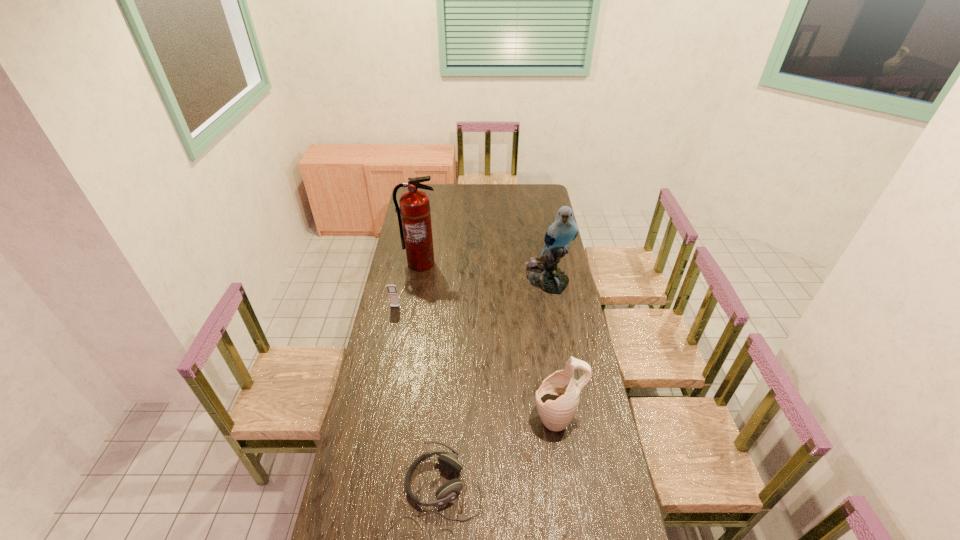
Find the location of a particular element. The width and height of the screenshot is (960, 540). fire extinguisher is located at coordinates (414, 209).

Where is `parakeet`? The image size is (960, 540). parakeet is located at coordinates (542, 272).

Where is `pitcher`? The height and width of the screenshot is (540, 960). pitcher is located at coordinates (557, 399).

Where is `the fourth farthest object`? the fourth farthest object is located at coordinates (557, 399).

I want to click on the second shortest object, so click(x=392, y=290).

At what (x,y) coordinates should I click in order to perform the action: click on cellular telephone. Please return your answer as a coordinate pair (x, y). Image resolution: width=960 pixels, height=540 pixels. Looking at the image, I should click on (392, 290).

The height and width of the screenshot is (540, 960). I want to click on free space located 0.360m on the side of the fire extinguisher with the handle and hose, so click(411, 322).

Where is `free region located on the face of the parakeet`? free region located on the face of the parakeet is located at coordinates (552, 306).

The height and width of the screenshot is (540, 960). In order to click on free space located at the spout of the pitcher in this screenshot , I will do `click(483, 418)`.

Image resolution: width=960 pixels, height=540 pixels. In order to click on vacant position located at the spout of the pitcher in this screenshot , I will do `click(427, 418)`.